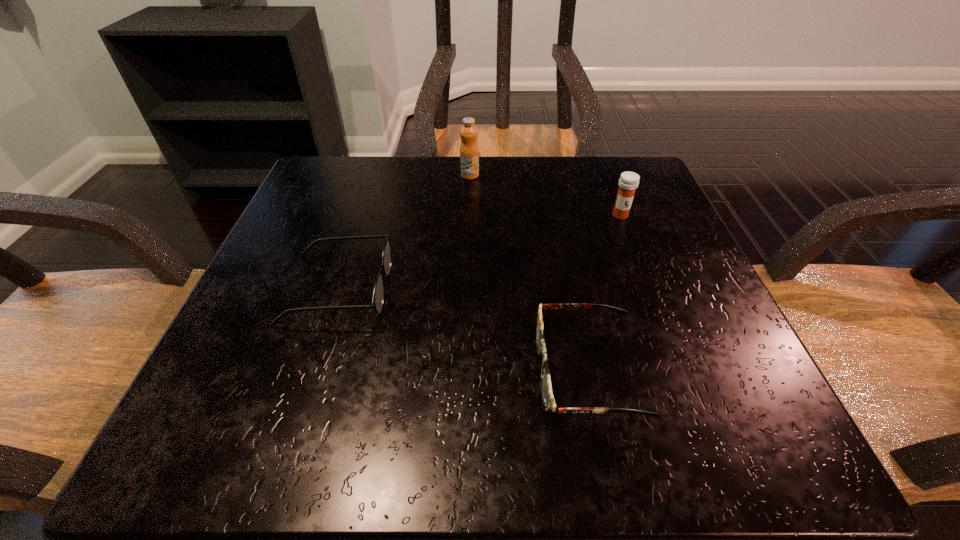
Locate an element on the screen. This screenshot has width=960, height=540. vacant area that satisfies the following two spatial constraints: 1. on the label side of the second farthest object; 2. on the frame of the second object from right to left is located at coordinates (681, 371).

Find the location of a particular element. This screenshot has height=540, width=960. vacant space that satisfies the following two spatial constraints: 1. on the front label of the tallest object; 2. on the front-facing side of the left spectacles is located at coordinates (467, 289).

Identify the location of vacant region that satisfies the following two spatial constraints: 1. on the label side of the third nearest object; 2. on the front-facing side of the leftmost object. Image resolution: width=960 pixels, height=540 pixels. (649, 289).

You are a GUI agent. You are given a task and a screenshot of the screen. Output one action in this format:
    pyautogui.click(x=<x>, y=<y>)
    Task: Click on the vacant space that satisfies the following two spatial constraints: 1. on the front label of the orange juice; 2. on the front-facing side of the left spectacles
    The width and height of the screenshot is (960, 540).
    Given the screenshot: What is the action you would take?
    pyautogui.click(x=467, y=289)